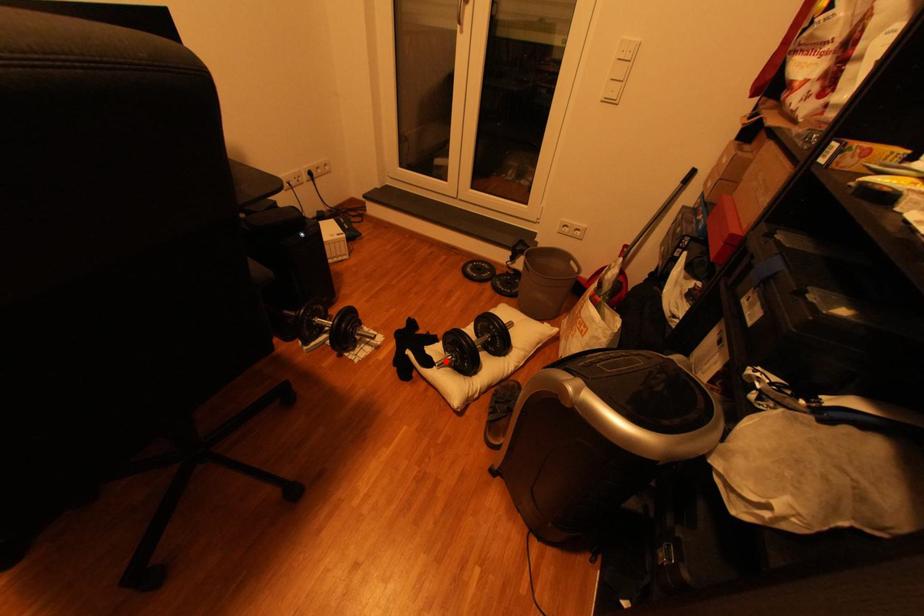
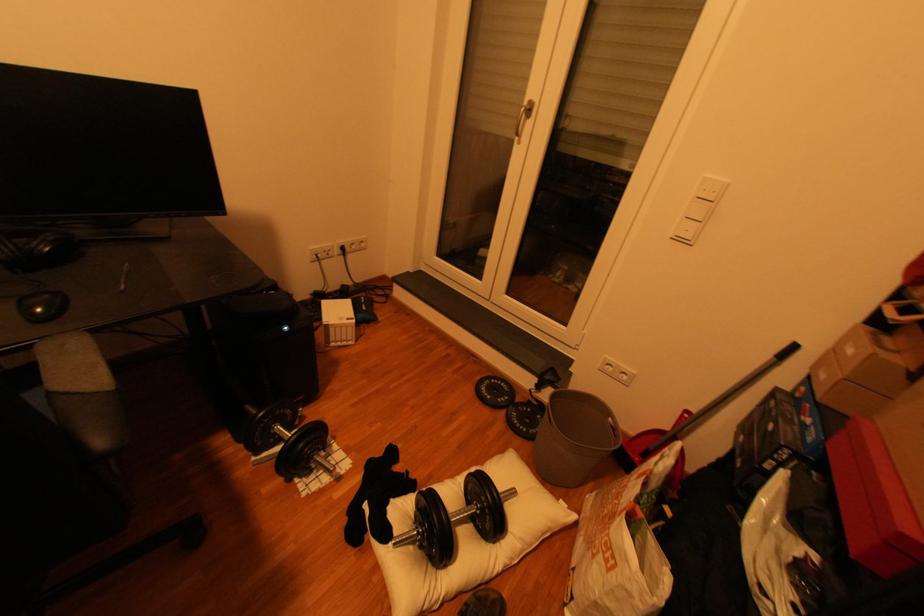
Question: I am providing you with two images of the same scene from different viewpoints. Image1 has a red point marked. In image2, the corresponding 3D location appears at what relative position? Reply with the corresponding letter.

Choices:
 (A) Closer
 (B) Farther

Answer: (A)